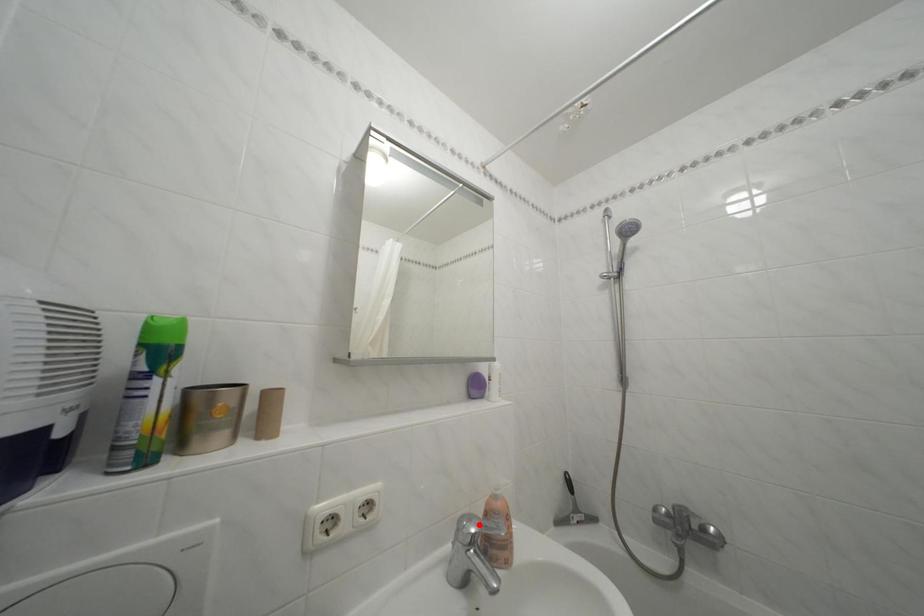
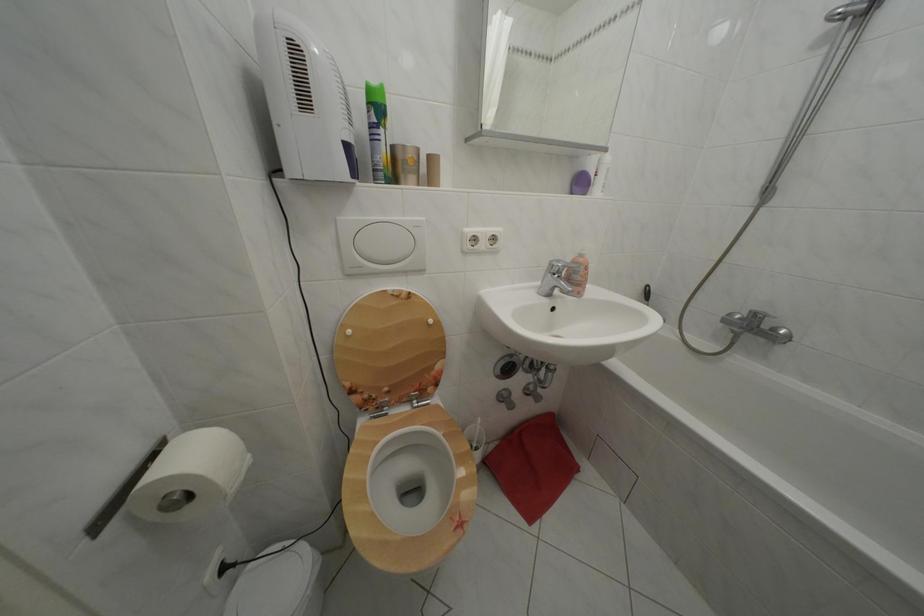
Where in the second image is the point corresponding to the highlighted location from the first image?

(567, 268)